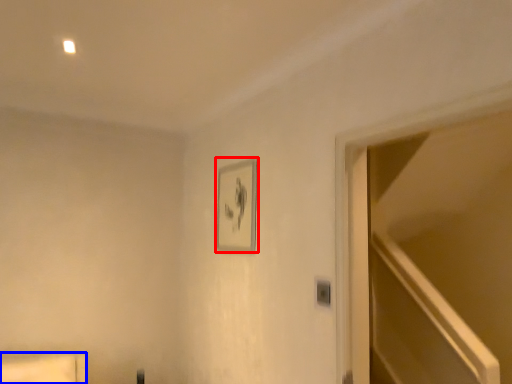
Question: Which point is closer to the camera, picture frame (highlighted by a red box) or furniture (highlighted by a blue box)?

Choices:
 (A) picture frame
 (B) furniture

Answer: (B)